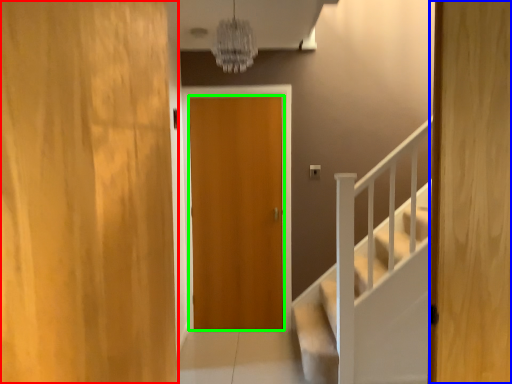
Question: Estimate the real-world distances between objects in this image. Which object is closer to door (highlighted by a red box), door (highlighted by a blue box) or door (highlighted by a green box)?

Choices:
 (A) door
 (B) door

Answer: (A)